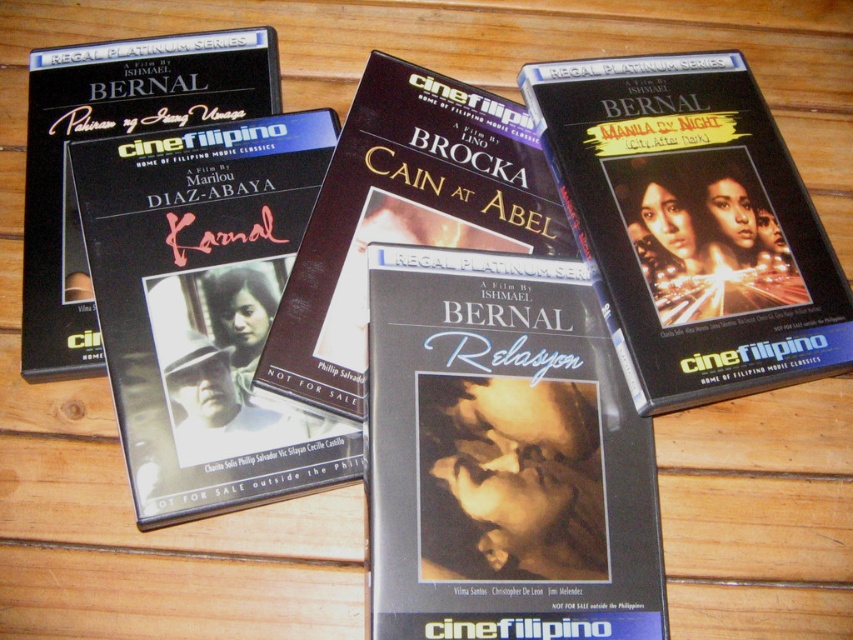
You are organizing a library shelf and see the matte black dvd case at upper right and the matte black book at center. Which item is positioned to the right of the other?

The matte black dvd case at upper right is to the right of the matte black book at center.